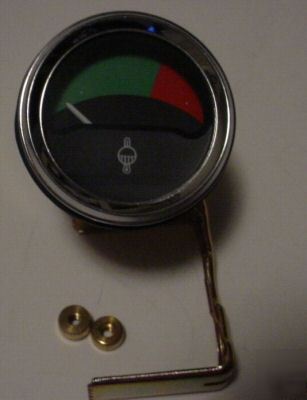
The width and height of the screenshot is (307, 400). Identify the location of wall. (245, 55).